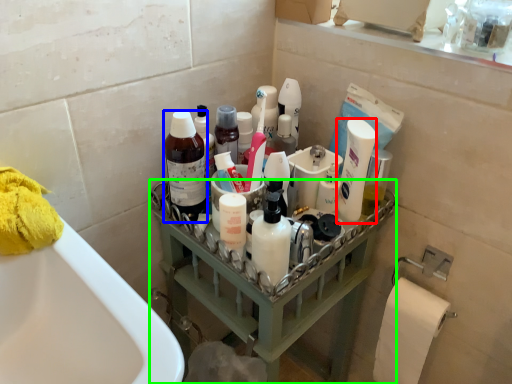
Question: Which object is positioned closest to mouthwash (highlighted by a red box)? Select from cleaning product (highlighted by a blue box) and balustrade (highlighted by a green box).

Choices:
 (A) cleaning product
 (B) balustrade

Answer: (B)